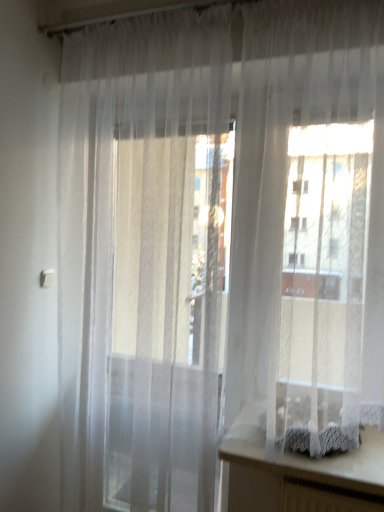
Question: From the image's perspective, is white lace vanity at lower right located beneath sheer white curtain at center?

Choices:
 (A) yes
 (B) no

Answer: (A)

Question: Is white lace vanity at lower right oriented away from sheer white curtain at center?

Choices:
 (A) yes
 (B) no

Answer: (B)

Question: Is sheer white curtain at center a part of white lace vanity at lower right?

Choices:
 (A) no
 (B) yes

Answer: (A)

Question: Does white lace vanity at lower right appear on the left side of sheer white curtain at center?

Choices:
 (A) no
 (B) yes

Answer: (A)

Question: Does white lace vanity at lower right have a larger size compared to sheer white curtain at center?

Choices:
 (A) yes
 (B) no

Answer: (B)

Question: Is white lace vanity at lower right positioned behind sheer white curtain at center?

Choices:
 (A) no
 (B) yes

Answer: (B)

Question: Is white lace vanity at lower right surrounded by sheer white curtain at center?

Choices:
 (A) yes
 (B) no

Answer: (B)

Question: Considering the relative sizes of sheer white curtain at center and white lace vanity at lower right in the image provided, is sheer white curtain at center taller than white lace vanity at lower right?

Choices:
 (A) yes
 (B) no

Answer: (A)

Question: Can we say sheer white curtain at center lies outside white lace vanity at lower right?

Choices:
 (A) no
 (B) yes

Answer: (B)

Question: From a real-world perspective, is sheer white curtain at center over white lace vanity at lower right?

Choices:
 (A) no
 (B) yes

Answer: (B)

Question: Can you confirm if sheer white curtain at center is bigger than white lace vanity at lower right?

Choices:
 (A) yes
 (B) no

Answer: (A)

Question: From a real-world perspective, is sheer white curtain at center under white lace vanity at lower right?

Choices:
 (A) yes
 (B) no

Answer: (B)

Question: Is white lace vanity at lower right situated inside sheer white curtain at center or outside?

Choices:
 (A) outside
 (B) inside

Answer: (A)